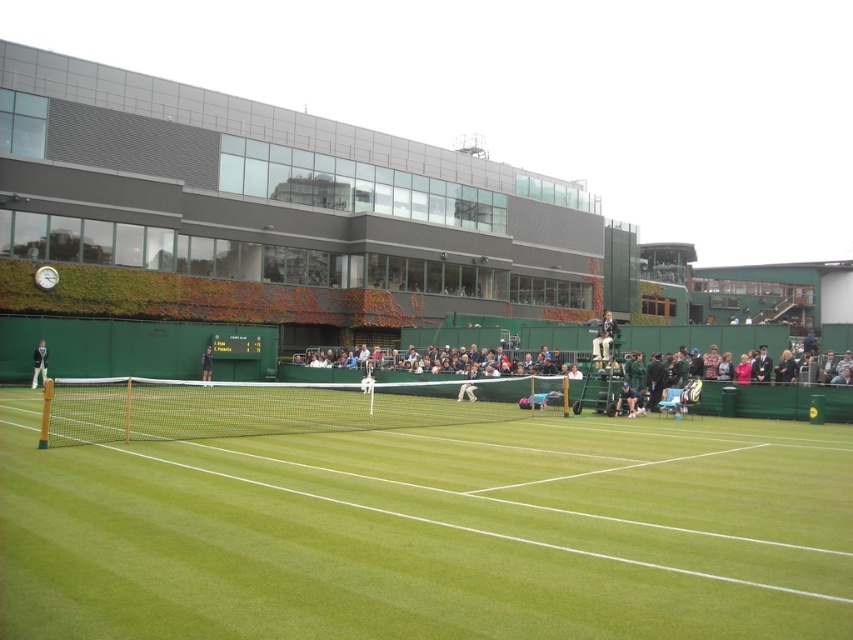
Does green fabric chair at center have a larger size compared to dark blue shirt at center?

Incorrect, green fabric chair at center is not larger than dark blue shirt at center.

Who is taller, green fabric chair at center or dark blue shirt at center?

dark blue shirt at center is taller.

Is point (630, 416) positioned before point (210, 355)?

Yes, point (630, 416) is closer to viewer.

The image size is (853, 640). In order to click on green fabric chair at center in this screenshot , I will do `click(627, 400)`.

Can you confirm if green grass tennis court at center is positioned below dark blue shirt at center?

Yes, green grass tennis court at center is below dark blue shirt at center.

Can you confirm if green grass tennis court at center is smaller than dark blue shirt at center?

Incorrect, green grass tennis court at center is not smaller in size than dark blue shirt at center.

At what (x,y) coordinates should I click in order to perform the action: click on green grass tennis court at center. Please return your answer as a coordinate pair (x, y). The width and height of the screenshot is (853, 640). Looking at the image, I should click on (431, 531).

Consider the image. Can you confirm if green grass tennis court at center is smaller than green fabric chair at center?

No, green grass tennis court at center is not smaller than green fabric chair at center.

At what (x,y) coordinates should I click in order to perform the action: click on green grass tennis court at center. Please return your answer as a coordinate pair (x, y). Looking at the image, I should click on (431, 531).

Is point (196, 540) closer to viewer compared to point (631, 417)?

Yes, it is in front of point (631, 417).

Identify the location of green grass tennis court at center. (431, 531).